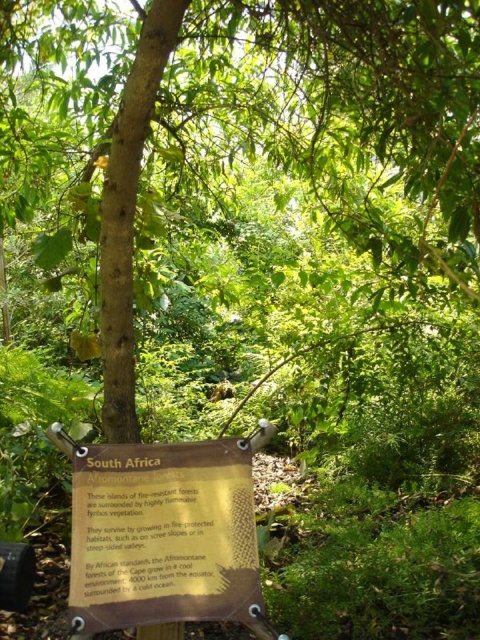
This screenshot has width=480, height=640. I want to click on brown rough bark tree at center, so click(x=311, y=131).

Does point (203, 24) come farther from viewer compared to point (180, 556)?

Yes, it is.

Who is more distant from viewer, (421, 38) or (152, 470)?

The point (421, 38) is more distant.

At what (x,y) coordinates should I click in order to perform the action: click on brown rough bark tree at center. Please return your answer as a coordinate pair (x, y). The width and height of the screenshot is (480, 640). Looking at the image, I should click on (311, 131).